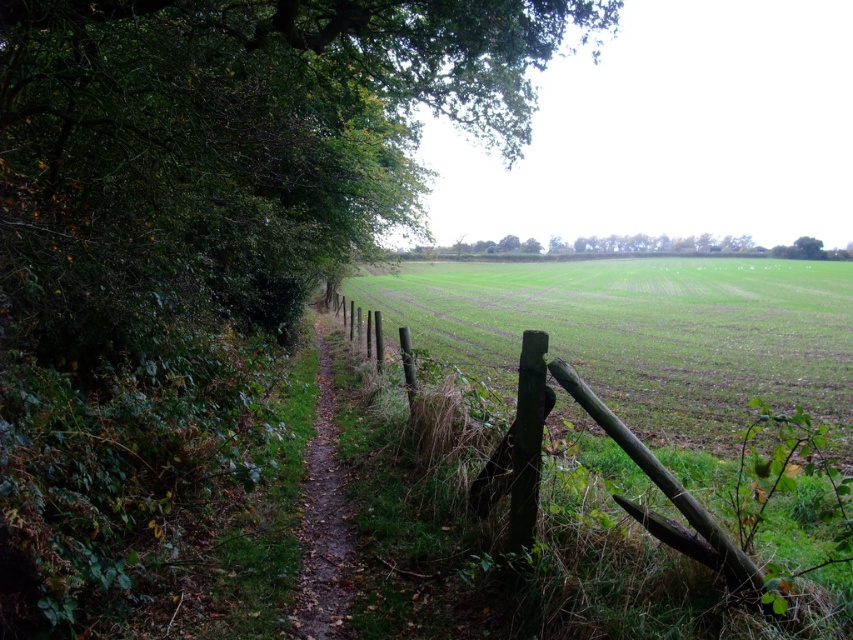
Between green leafy tree at upper left and green grassy field at center, which one has more height?

green leafy tree at upper left is taller.

Which is behind, point (265, 154) or point (606, 317)?

Point (606, 317)

Where is `green leafy tree at upper left`? The height and width of the screenshot is (640, 853). green leafy tree at upper left is located at coordinates (198, 230).

Is brown dirt path at center thinner than green leafy tree at center?

Indeed, brown dirt path at center has a lesser width compared to green leafy tree at center.

Who is higher up, brown dirt path at center or green leafy tree at center?

Positioned higher is green leafy tree at center.

Find the location of `brown dirt path at center`. brown dirt path at center is located at coordinates (323, 522).

Between green leafy tree at upper left and weathered wood fence at center, which one is positioned lower?

Positioned lower is weathered wood fence at center.

Does green leafy tree at upper left appear on the left side of weathered wood fence at center?

Incorrect, green leafy tree at upper left is not on the left side of weathered wood fence at center.

Who is more distant from viewer, (247, 376) or (596, 620)?

The point (247, 376) is more distant.

Where is `green leafy tree at upper left`? This screenshot has width=853, height=640. green leafy tree at upper left is located at coordinates (198, 230).